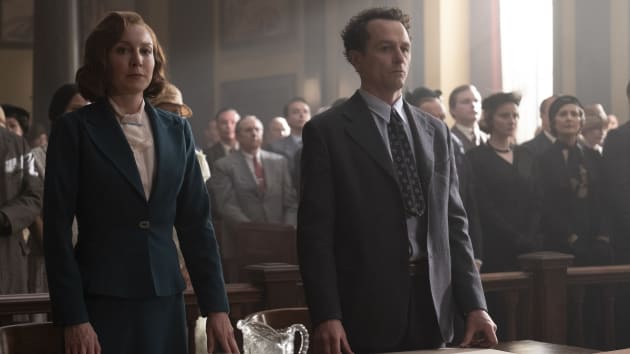
Locate an element on the screen. large window is located at coordinates point(530,38).